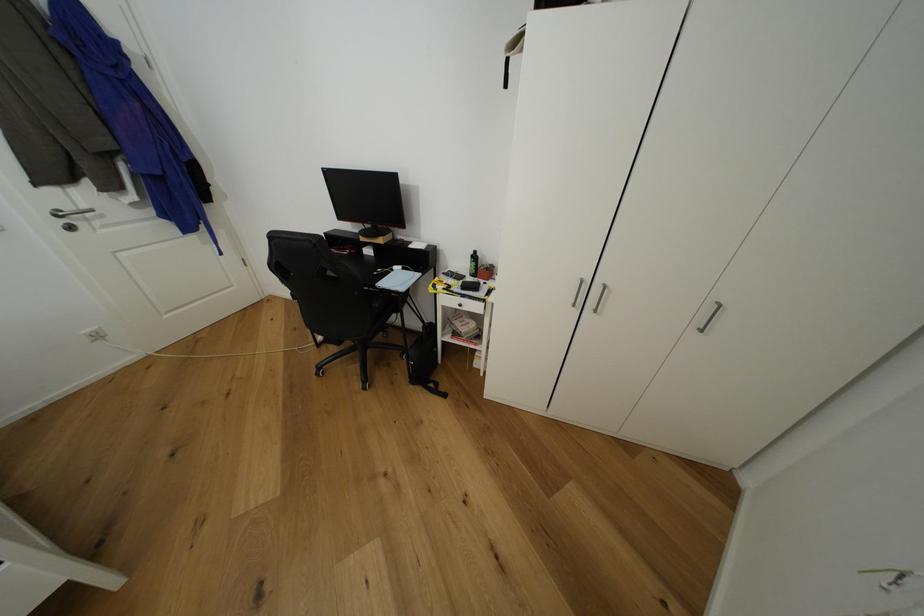
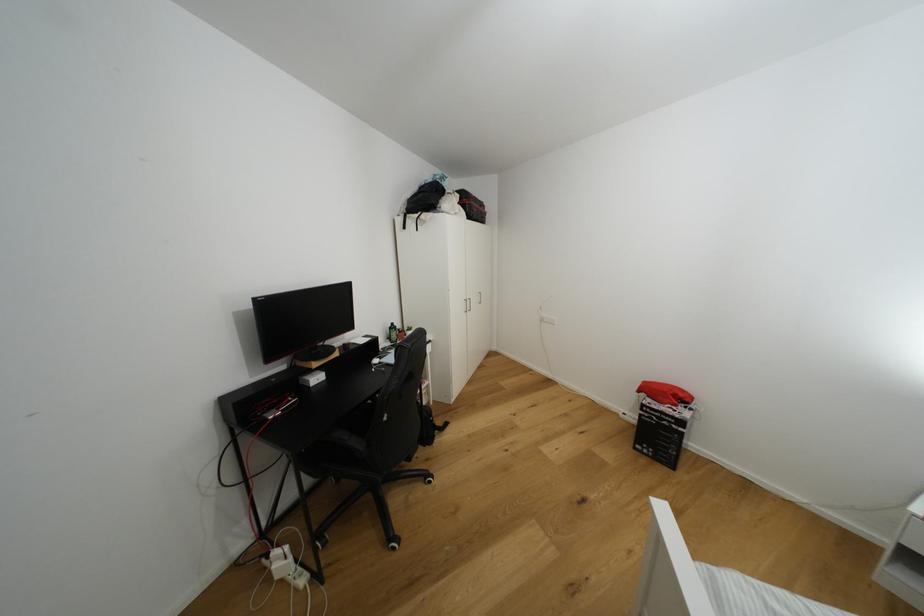
Where in the second image is the point corresponding to (x=478, y=257) from the first image?

(395, 330)